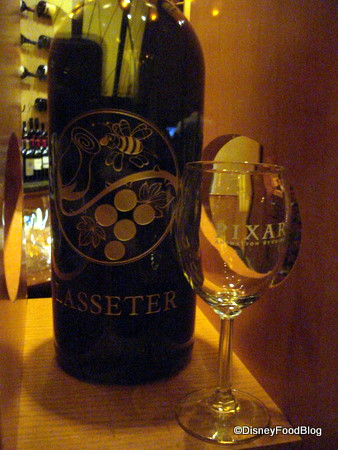
Where is `wine glass stem`? The height and width of the screenshot is (450, 338). wine glass stem is located at coordinates (225, 371).